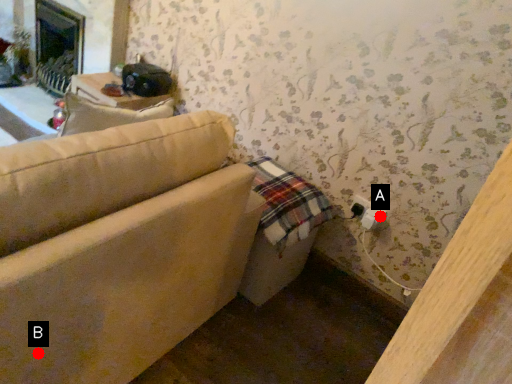
Question: Two points are circled on the image, labeled by A and B beside each circle. Which point is closer to the camera taking this photo?

Choices:
 (A) A is closer
 (B) B is closer

Answer: (B)